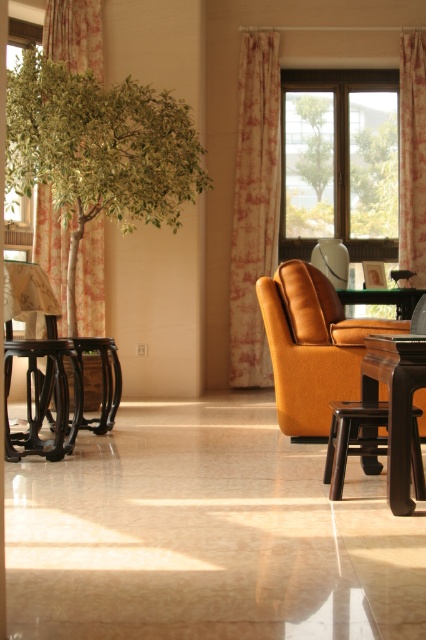
You are standing in the living room and want to move from the table with the patterned tablecloth to the large window. There are two points marked as point (299, 92) and point (412, 163) on your path. Which point should you avoid stepping on if you want to stay closer to the window?

You should avoid stepping on point (299, 92) because it is behind point (412, 163), meaning it is farther from the window.

You are arranging a room and need to place a 3.5 feet wide sofa between the floral fabric curtain at upper right and the wooden table at center. Can the sofa fit in the space between them?

The distance between the floral fabric curtain at upper right and the wooden table at center is 4.20 feet, which is wider than the 3.5 feet width of the sofa. Therefore, the sofa can fit in the space between them.

Based on the photo, you are standing in the living room and see two points marked on the floor. The first point is at coordinates point (336, 372) and the second is at point (405, 420). Which point is closer to you?

Point (336, 372) is closer to you because it is further to the viewer than point (405, 420).